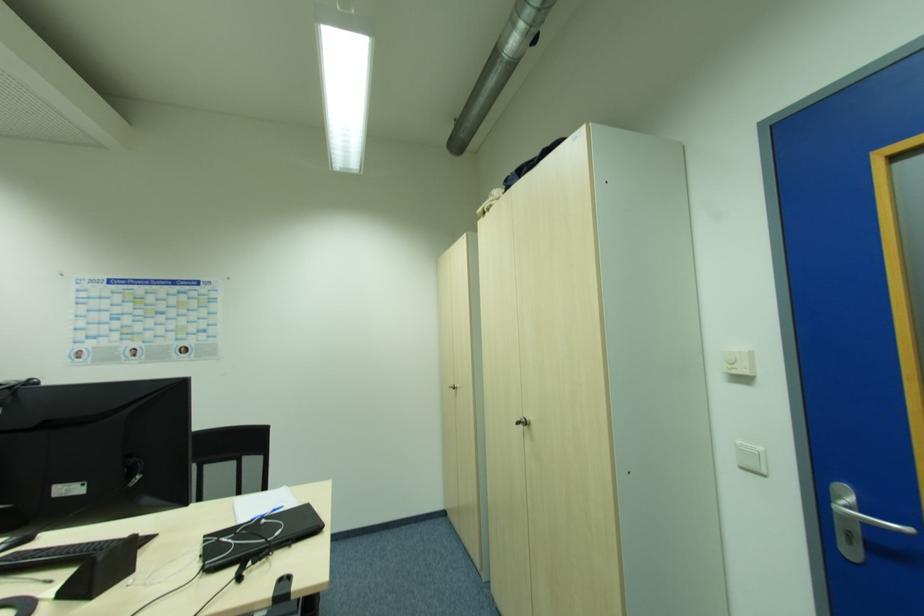
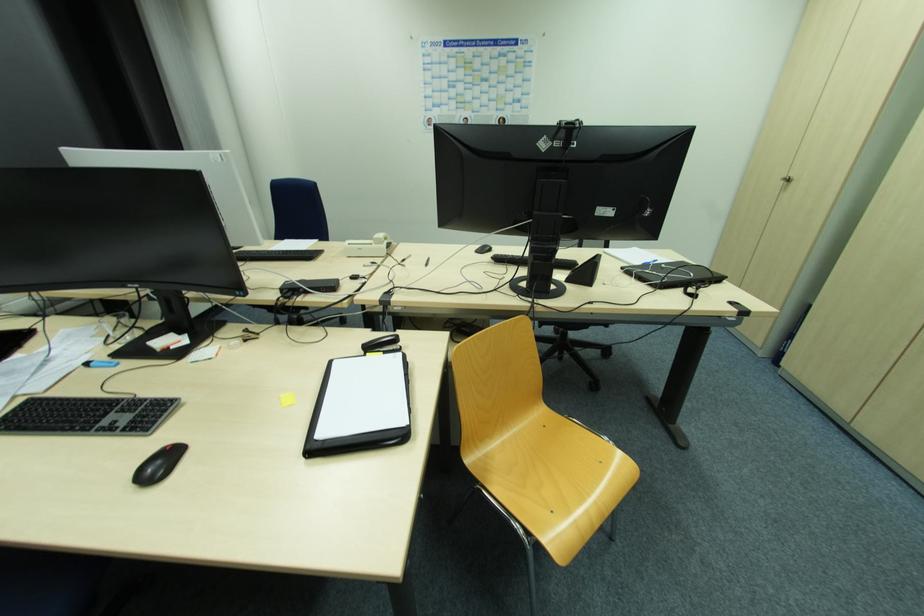
Locate, in the second image, the point that corresponds to point (455, 390) in the first image.

(784, 183)